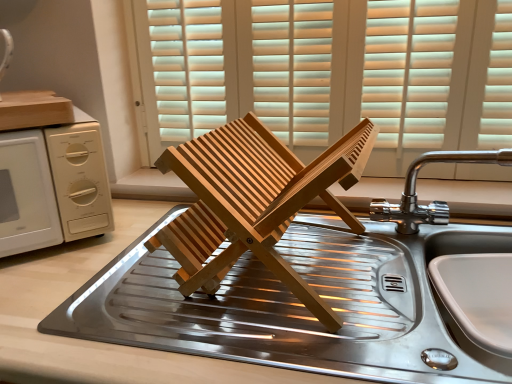
Question: Visually, is white matte microwave at left positioned to the left or to the right of wooden blinds at center?

Choices:
 (A) right
 (B) left

Answer: (B)

Question: From a real-world perspective, is white matte microwave at left above or below wooden blinds at center?

Choices:
 (A) below
 (B) above

Answer: (A)

Question: Which object is positioned closest to the white matte microwave at left?

Choices:
 (A) stainless steel sink at center
 (B) chrome metallic faucet at upper right
 (C) wooden blinds at center

Answer: (A)

Question: Based on their relative distances, which object is farther from the stainless steel sink at center?

Choices:
 (A) white matte microwave at left
 (B) chrome metallic faucet at upper right
 (C) wooden blinds at center

Answer: (C)